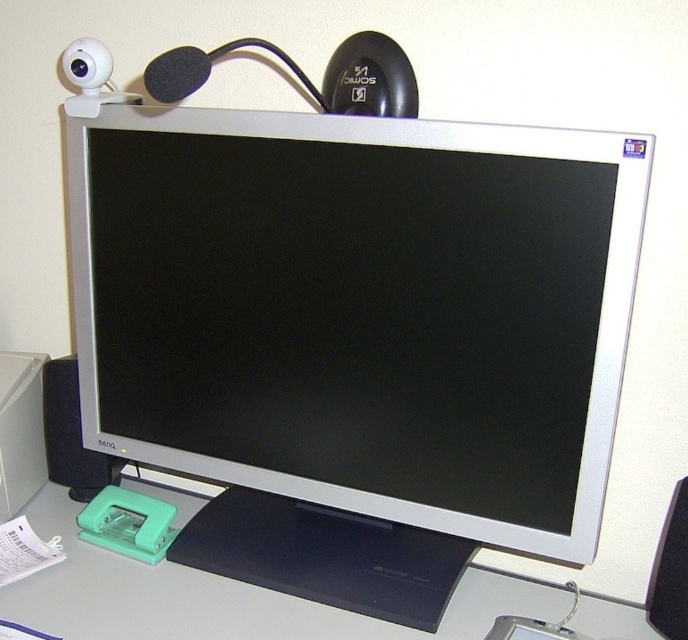
Who is shorter, white matte computer desk at lower center or black matte speaker at lower right?

With less height is white matte computer desk at lower center.

Between point (32, 525) and point (687, 620), which one is positioned behind?

Positioned behind is point (32, 525).

Describe the element at coordinates (225, 598) in the screenshot. I see `white matte computer desk at lower center` at that location.

This screenshot has width=688, height=640. Identify the location of white matte computer desk at lower center. (225, 598).

Consider the image. Can you confirm if black plastic speaker at lower left is smaller than black matte speaker at lower right?

Actually, black plastic speaker at lower left might be larger than black matte speaker at lower right.

Does point (61, 433) come closer to viewer compared to point (678, 611)?

No.

Where is `black plastic speaker at lower left`? The image size is (688, 640). black plastic speaker at lower left is located at coordinates (72, 435).

The width and height of the screenshot is (688, 640). In order to click on black plastic speaker at lower left in this screenshot , I will do `click(72, 435)`.

Between silver metallic monitor at center and black matte speaker at lower right, which one has more height?

Standing taller between the two is silver metallic monitor at center.

The width and height of the screenshot is (688, 640). In order to click on silver metallic monitor at center in this screenshot , I will do `click(358, 310)`.

Between point (572, 172) and point (658, 554), which one is positioned behind?

The point (658, 554) is behind.

Where is `silver metallic monitor at center`? This screenshot has height=640, width=688. silver metallic monitor at center is located at coordinates (358, 310).